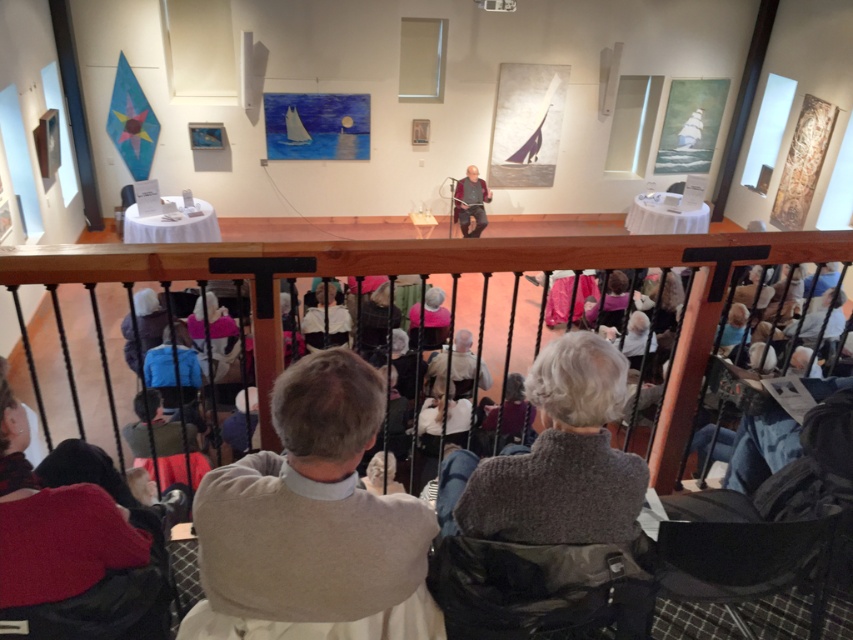
You are standing at the point with coordinates (x=439, y=273) in the gallery. What object is located exactly at your current position?

The wooden railing at center is located exactly at the point with coordinates (x=439, y=273).

You are standing on a balcony and want to hand a program to the person wearing the dark brown leather jacket at center. The wooden railing at center is in your way. Can you reach them without moving the railing?

The wooden railing at center is larger in size than dark brown leather jacket at center, so it might block your view or access. You may need to move closer or find another way to reach them.